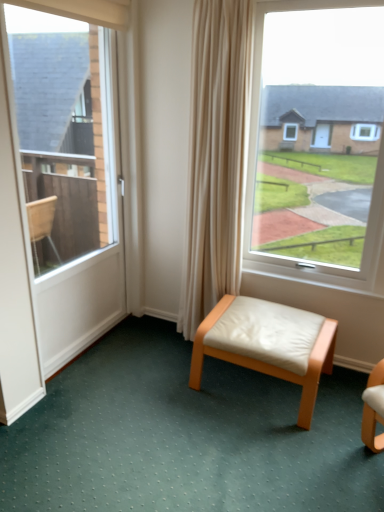
Question: From the image's perspective, does white leather stool at center appear lower than white glossy door at left?

Choices:
 (A) no
 (B) yes

Answer: (B)

Question: Is the depth of white leather stool at center greater than that of white glossy door at left?

Choices:
 (A) yes
 (B) no

Answer: (B)

Question: Is white leather stool at center facing towards white glossy door at left?

Choices:
 (A) yes
 (B) no

Answer: (B)

Question: Is white leather stool at center wider than white glossy door at left?

Choices:
 (A) yes
 (B) no

Answer: (A)

Question: Can you confirm if white leather stool at center is bigger than white glossy door at left?

Choices:
 (A) yes
 (B) no

Answer: (A)

Question: Can you see white leather stool at center touching white glossy door at left?

Choices:
 (A) yes
 (B) no

Answer: (B)

Question: Considering the relative positions of white glossy door at left and white leather stool at center in the image provided, is white glossy door at left to the right of white leather stool at center from the viewer's perspective?

Choices:
 (A) yes
 (B) no

Answer: (B)

Question: Considering the relative positions of white glossy door at left and white leather stool at center in the image provided, is white glossy door at left to the left of white leather stool at center from the viewer's perspective?

Choices:
 (A) yes
 (B) no

Answer: (A)

Question: Is white glossy door at left positioned far away from white leather stool at center?

Choices:
 (A) yes
 (B) no

Answer: (B)

Question: From the image's perspective, would you say white glossy door at left is shown under white leather stool at center?

Choices:
 (A) no
 (B) yes

Answer: (A)

Question: Can you confirm if white glossy door at left is wider than white leather stool at center?

Choices:
 (A) yes
 (B) no

Answer: (B)

Question: From a real-world perspective, is white glossy door at left positioned under white leather stool at center based on gravity?

Choices:
 (A) yes
 (B) no

Answer: (B)

Question: Is white leather stool at center next to white leather stool at center and touching it?

Choices:
 (A) no
 (B) yes

Answer: (A)